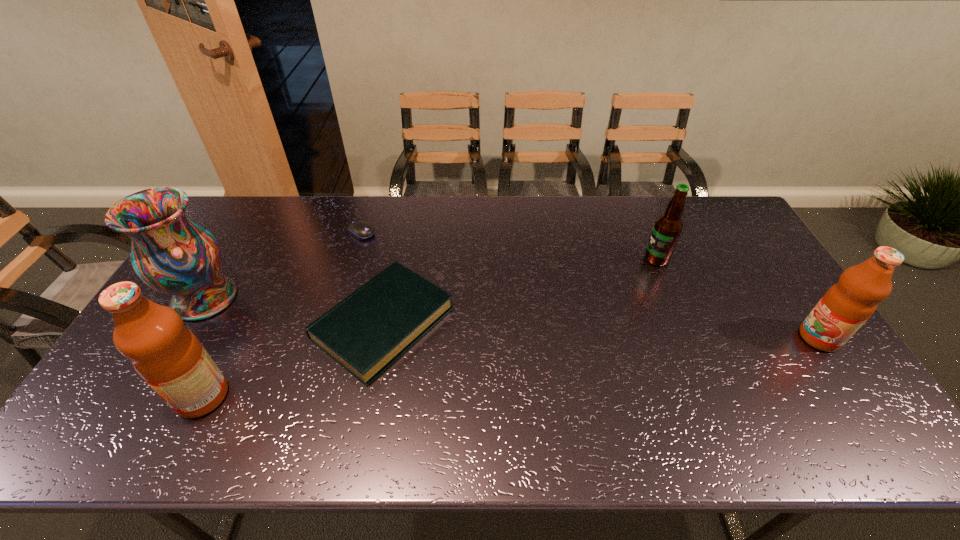
What are the coordinates of `blank region between the vase and the right fruit juice` in the screenshot? It's located at tap(512, 318).

Image resolution: width=960 pixels, height=540 pixels. Identify the location of the fifth closest object relative to the fifth nearest object. (172, 254).

The image size is (960, 540). In order to click on object that stands as the second closest to the book in this screenshot , I will do `click(361, 229)`.